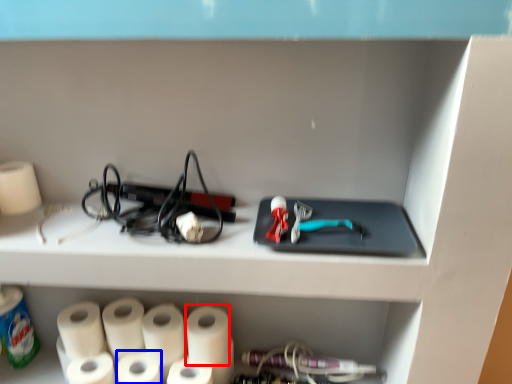
Question: Which object appears farthest to the camera in this image, paper towel (highlighted by a red box) or paper towel (highlighted by a blue box)?

Choices:
 (A) paper towel
 (B) paper towel

Answer: (A)